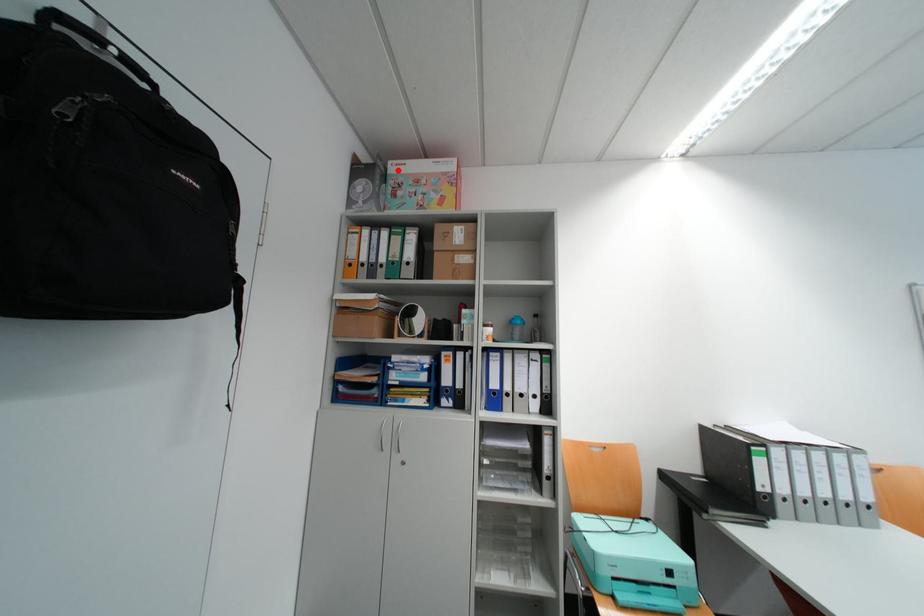
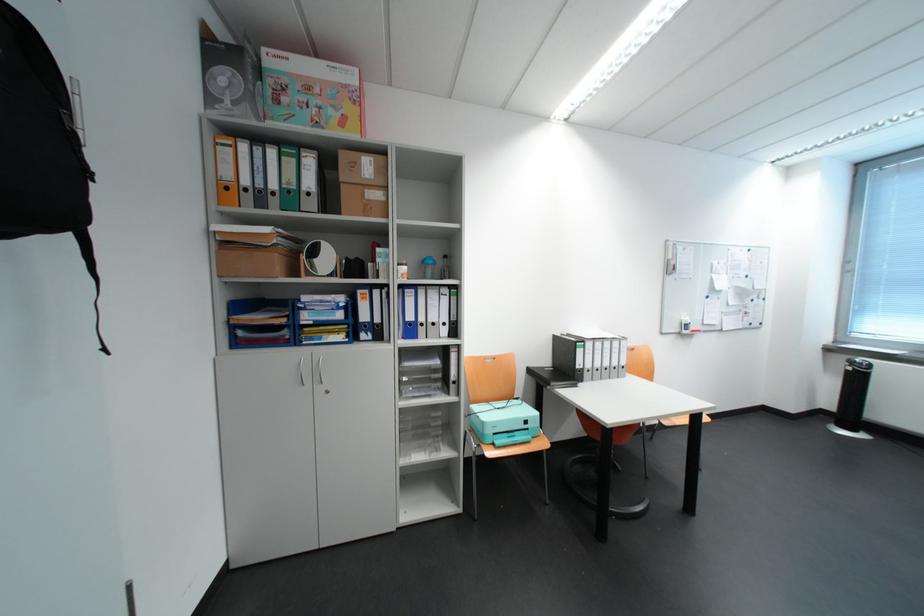
Question: I am providing you with two images of the same scene from different viewpoints. A red point is shown in image1. For the corresponding object point in image2, is it positioned nearer or farther from the camera?

Choices:
 (A) Nearer
 (B) Farther

Answer: (B)